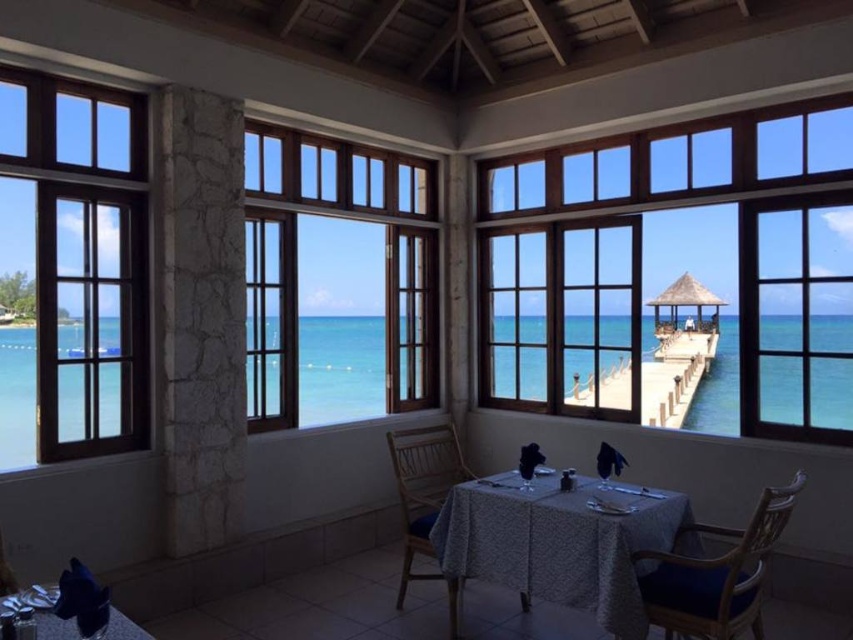
Question: Which object appears farthest from the camera in this image?

Choices:
 (A) wooden chair at center
 (B) white lace tablecloth at center

Answer: (A)

Question: Which object is the closest to the clear glass window at left?

Choices:
 (A) wooden frame at center
 (B) white lace tablecloth at center
 (C) wooden chair at center

Answer: (C)

Question: Does wooden frame at center appear on the right side of wooden chair at center?

Choices:
 (A) yes
 (B) no

Answer: (B)

Question: Is white lace tablecloth at center bigger than shiny silver tray at lower left?

Choices:
 (A) no
 (B) yes

Answer: (B)

Question: Is white lace tablecloth at center in front of wooden chair at lower right?

Choices:
 (A) yes
 (B) no

Answer: (B)

Question: Based on their relative distances, which object is nearer to the white lace tablecloth at center?

Choices:
 (A) wooden frame at right
 (B) shiny silver tray at lower left

Answer: (B)